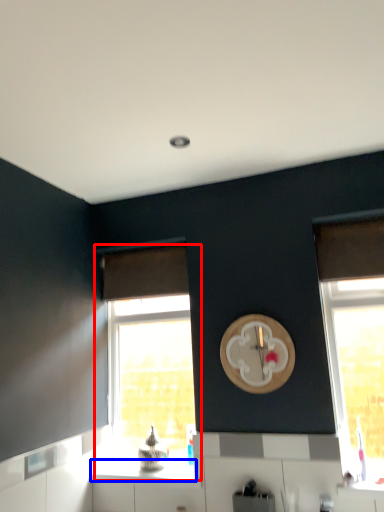
Question: Which object is further to the camera taking this photo, window (highlighted by a red box) or counter top (highlighted by a blue box)?

Choices:
 (A) window
 (B) counter top

Answer: (A)